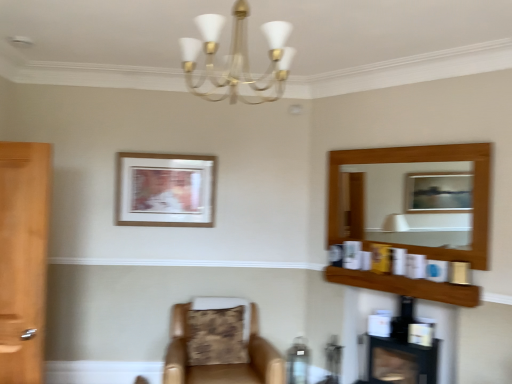
Question: Is gold metallic chandelier at upper center completely or partially inside black glossy fireplace at lower right?

Choices:
 (A) no
 (B) yes

Answer: (A)

Question: Is black glossy fireplace at lower right far from gold metallic chandelier at upper center?

Choices:
 (A) no
 (B) yes

Answer: (B)

Question: Can you confirm if black glossy fireplace at lower right is smaller than gold metallic chandelier at upper center?

Choices:
 (A) no
 (B) yes

Answer: (A)

Question: From a real-world perspective, is black glossy fireplace at lower right positioned over gold metallic chandelier at upper center based on gravity?

Choices:
 (A) yes
 (B) no

Answer: (B)

Question: From the image's perspective, is black glossy fireplace at lower right below gold metallic chandelier at upper center?

Choices:
 (A) yes
 (B) no

Answer: (A)

Question: In terms of width, does black glossy fireplace at lower right look wider or thinner when compared to wooden picture frame at upper center?

Choices:
 (A) thin
 (B) wide

Answer: (B)

Question: From a real-world perspective, is black glossy fireplace at lower right above or below wooden picture frame at upper center?

Choices:
 (A) below
 (B) above

Answer: (A)

Question: Is black glossy fireplace at lower right taller or shorter than wooden picture frame at upper center?

Choices:
 (A) short
 (B) tall

Answer: (B)

Question: Is point (432, 352) closer or farther from the camera than point (128, 215)?

Choices:
 (A) farther
 (B) closer

Answer: (B)

Question: Based on their sizes in the image, would you say wooden shelf at upper right is bigger or smaller than black glossy fireplace at lower right?

Choices:
 (A) small
 (B) big

Answer: (A)

Question: Is point (437, 286) positioned closer to the camera than point (394, 372)?

Choices:
 (A) closer
 (B) farther

Answer: (A)

Question: Is wooden shelf at upper right in front of or behind black glossy fireplace at lower right in the image?

Choices:
 (A) behind
 (B) front

Answer: (B)

Question: From a real-world perspective, is wooden shelf at upper right positioned above or below black glossy fireplace at lower right?

Choices:
 (A) below
 (B) above

Answer: (B)

Question: Is leather at center bigger or smaller than wooden picture frame at upper center?

Choices:
 (A) big
 (B) small

Answer: (A)

Question: In the image, is leather at center positioned in front of or behind wooden picture frame at upper center?

Choices:
 (A) front
 (B) behind

Answer: (A)